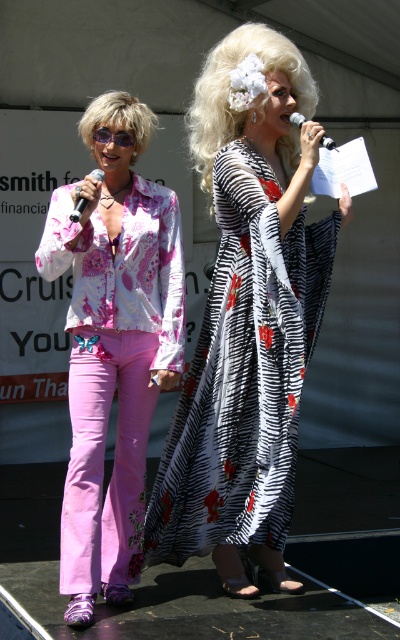
Can you confirm if blonde synthetic wig at left is bigger than purple plastic goggles at left?

Yes, blonde synthetic wig at left is bigger than purple plastic goggles at left.

Is the position of blonde synthetic wig at left more distant than that of purple plastic goggles at left?

No, blonde synthetic wig at left is in front of purple plastic goggles at left.

This screenshot has width=400, height=640. What are the coordinates of `blonde synthetic wig at left` in the screenshot? It's located at [118, 120].

Image resolution: width=400 pixels, height=640 pixels. I want to click on blonde synthetic wig at left, so click(x=118, y=120).

Is pink satin blouse at center closer to camera compared to zebra-patterned fabric dress at center?

Yes, it is.

Does point (92, 348) come in front of point (236, 410)?

Yes, it is.

Between point (134, 278) and point (293, 500), which one is positioned behind?

Point (293, 500)

The height and width of the screenshot is (640, 400). I want to click on pink satin blouse at center, so pyautogui.click(x=113, y=348).

Does blonde synthetic wig at left appear on the left side of matte black microphone at left?

Incorrect, blonde synthetic wig at left is not on the left side of matte black microphone at left.

Is blonde synthetic wig at left positioned in front of matte black microphone at left?

No, it is behind matte black microphone at left.

Is point (107, 93) more distant than point (101, 173)?

Yes, it is.

You are a GUI agent. You are given a task and a screenshot of the screen. Output one action in this format:
    pyautogui.click(x=<x>, y=<y>)
    Task: Click on the blonde synthetic wig at left
    The width and height of the screenshot is (400, 640).
    Given the screenshot: What is the action you would take?
    pyautogui.click(x=118, y=120)